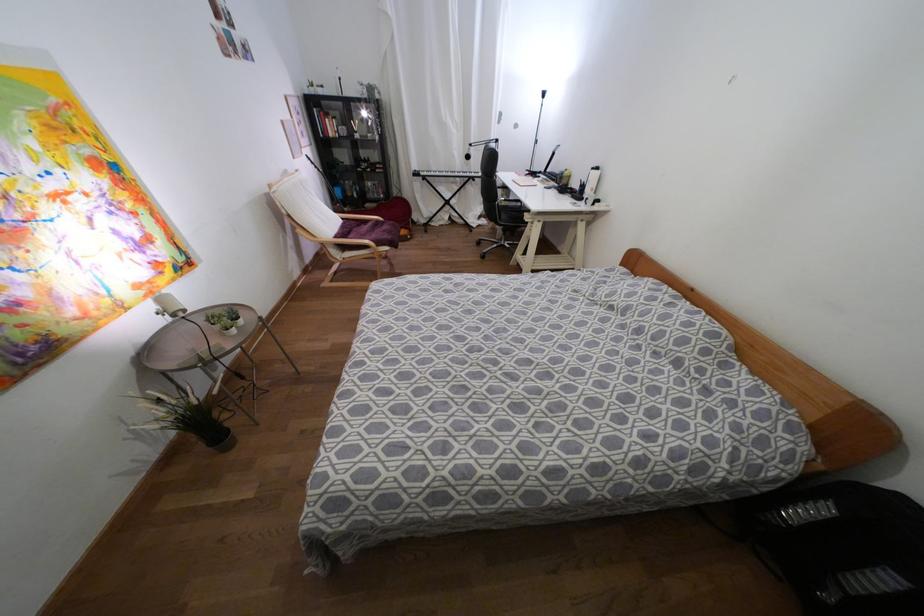
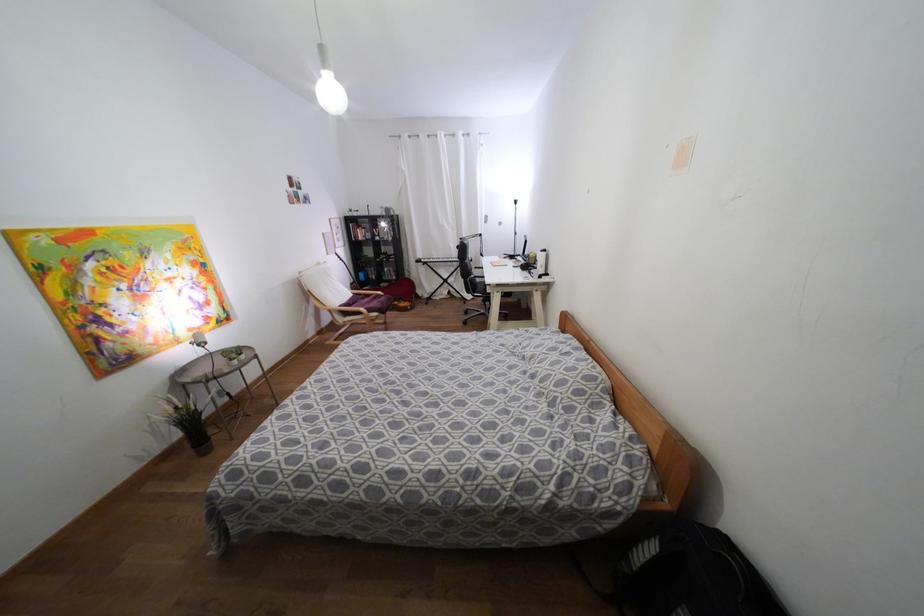
Locate, in the second image, the point that corresponds to the point at 330,134 in the first image.

(359, 238)